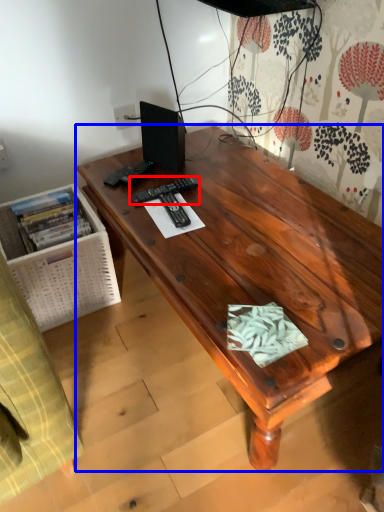
Question: Which of the following is the closest to the observer, remote control (highlighted by a red box) or desk (highlighted by a blue box)?

Choices:
 (A) remote control
 (B) desk

Answer: (B)